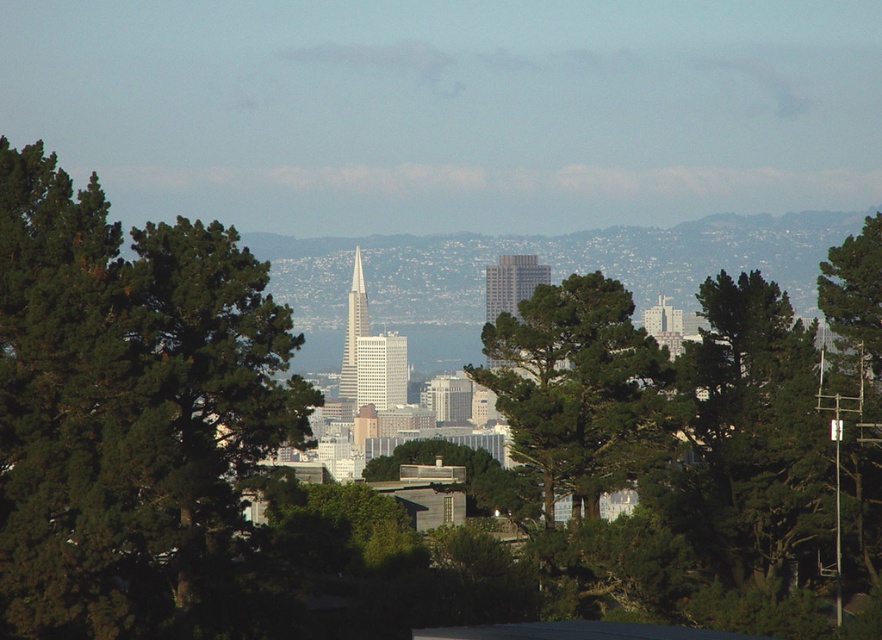
Question: Based on their relative distances, which object is farther from the green leafy tree at right?

Choices:
 (A) gray glass skyscraper at center
 (B) green leafy tree at left

Answer: (B)

Question: In this image, where is green leafy tree at left located relative to glassy silver skyscraper at center?

Choices:
 (A) right
 (B) left

Answer: (B)

Question: Estimate the real-world distances between objects in this image. Which object is farther from the green leafy tree at left?

Choices:
 (A) gray glass skyscraper at center
 (B) white glass skyscraper at center
 (C) glassy silver skyscraper at center

Answer: (A)

Question: Is green leafy tree at left to the left of white glass skyscraper at center from the viewer's perspective?

Choices:
 (A) no
 (B) yes

Answer: (B)

Question: Which point is farther to the camera?

Choices:
 (A) green leafy tree at left
 (B) glassy silver skyscraper at center
 (C) green leafy tree at right
 (D) white glass skyscraper at center

Answer: (C)

Question: Does green leafy tree at right appear on the right side of glassy silver skyscraper at center?

Choices:
 (A) no
 (B) yes

Answer: (B)